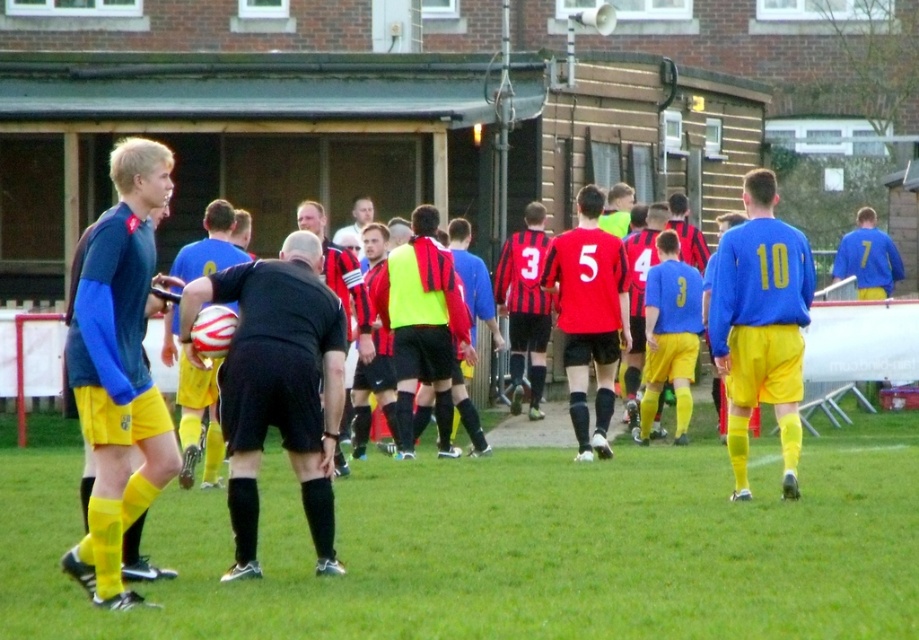
You are a soccer coach analyzing the field layout. You notice the yellow matte shorts at center and the blue jersey at right. Which of these two items is positioned higher in the image?

The yellow matte shorts at center is taller than the blue jersey at right, so it is positioned higher in the image.

You are a soccer player wearing a black jersey at center. You need to pass the ball to your teammate wearing a blue jersey at right. The ball is currently at your feet. Is the distance between you and your teammate sufficient to make a direct pass without needing to dribble the ball further?

The distance between blue jersey at right and black jersey at center is 3.71 meters, so yes, the distance is sufficient to make a direct pass without needing to dribble further.